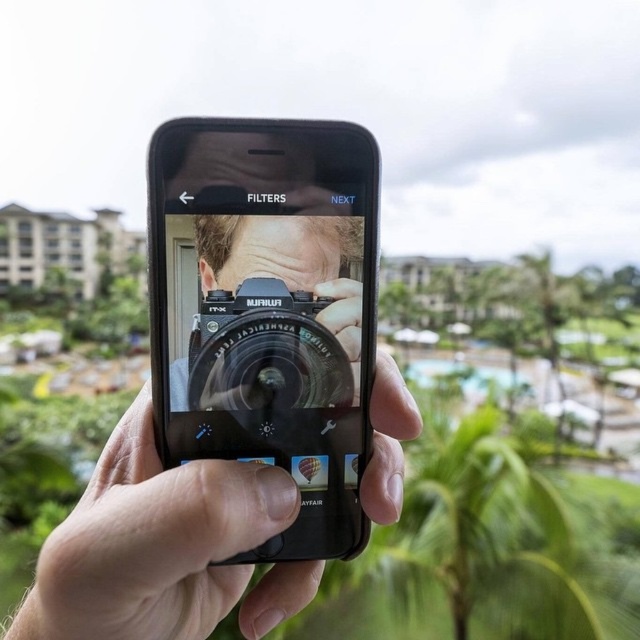
You are holding a black matte smartphone at center and want to place it on a table with a matte black phone at center already present. Which device will appear closer to you when both are placed on the table?

The black matte smartphone at center will appear closer to you because it is further to the viewer than the matte black phone at center when placed on the table.

You are holding a black matte smartphone at center and a matte black phone at center. Which one has a wider screen?

The matte black phone at center has a wider screen since the black matte smartphone at center is narrower than it.